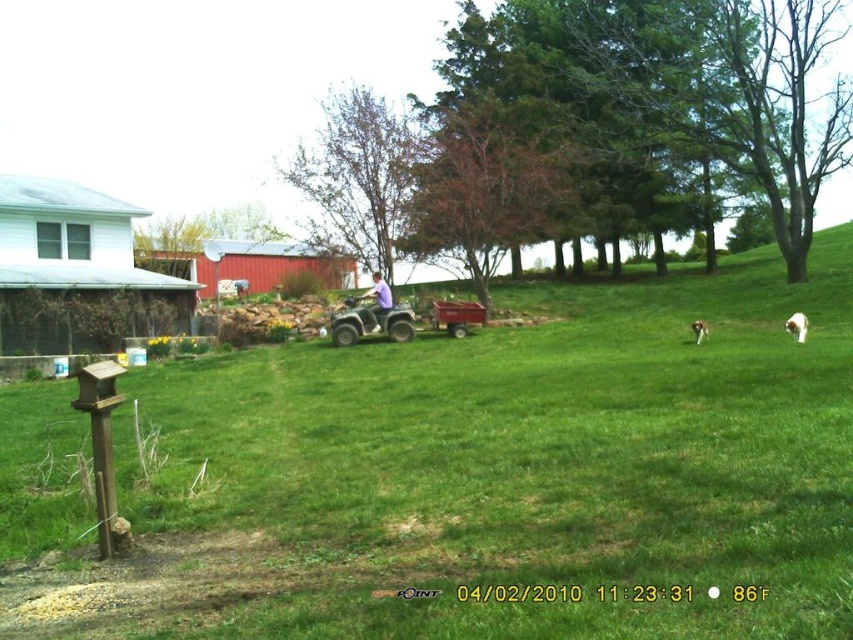
You are standing at the edge of the lawn and want to reach the red barn in the background. If you walk straight ahead, will you step on the green grass at center before reaching the red barn?

Yes, because the green grass at center is only 1.41 meters away from you, which is closer than the red barn in the background.